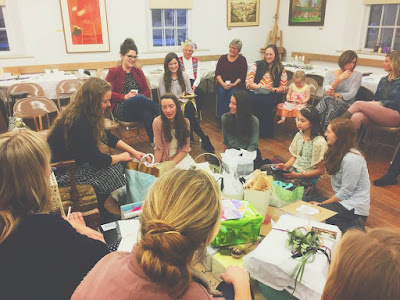
The height and width of the screenshot is (300, 400). I want to click on wall, so click(42, 38), click(334, 24).